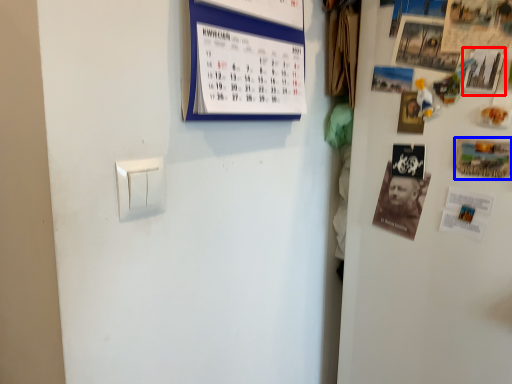
Question: Which point is closer to the camera, poster (highlighted by a red box) or postcard (highlighted by a blue box)?

Choices:
 (A) poster
 (B) postcard

Answer: (A)